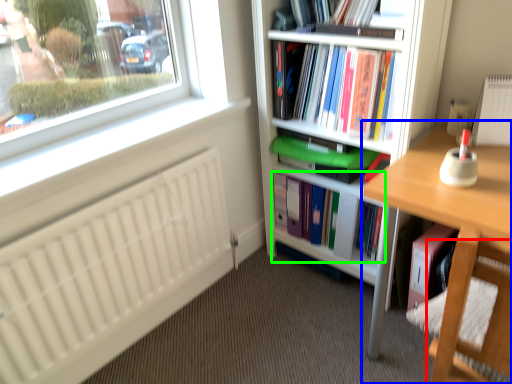
Question: Considering the real-world distances, which object is farthest from swivel chair (highlighted by a red box)? desk (highlighted by a blue box) or book (highlighted by a green box)?

Choices:
 (A) desk
 (B) book

Answer: (B)